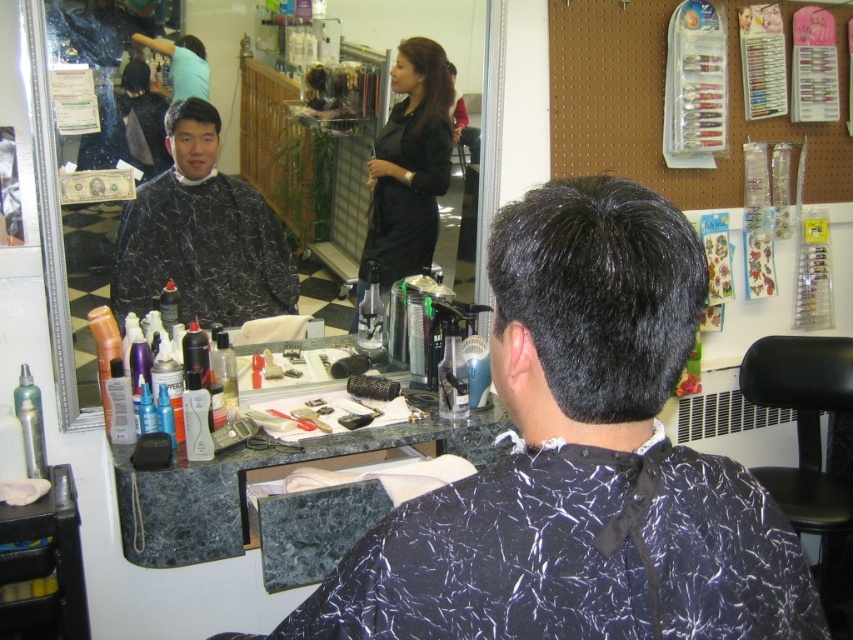
Question: Can you confirm if black marbled barber cape at center is positioned to the left of matte black hair at upper center?

Choices:
 (A) no
 (B) yes

Answer: (B)

Question: Is black marbled barber cape at center bigger than black marble hairdresser cape at upper left?

Choices:
 (A) yes
 (B) no

Answer: (A)

Question: Which point appears closest to the camera in this image?

Choices:
 (A) (418, 72)
 (B) (190, 38)
 (C) (198, 257)

Answer: (B)

Question: Does black satin dress at center come in front of black marble hairdresser cape at upper left?

Choices:
 (A) yes
 (B) no

Answer: (B)

Question: Which object appears farthest from the camera in this image?

Choices:
 (A) matte black hair at upper center
 (B) black marble hairdresser cape at upper left

Answer: (B)

Question: Which object is positioned farthest from the matte black hair at upper center?

Choices:
 (A) black marble hairdresser cape at upper left
 (B) black matte hair at center

Answer: (B)